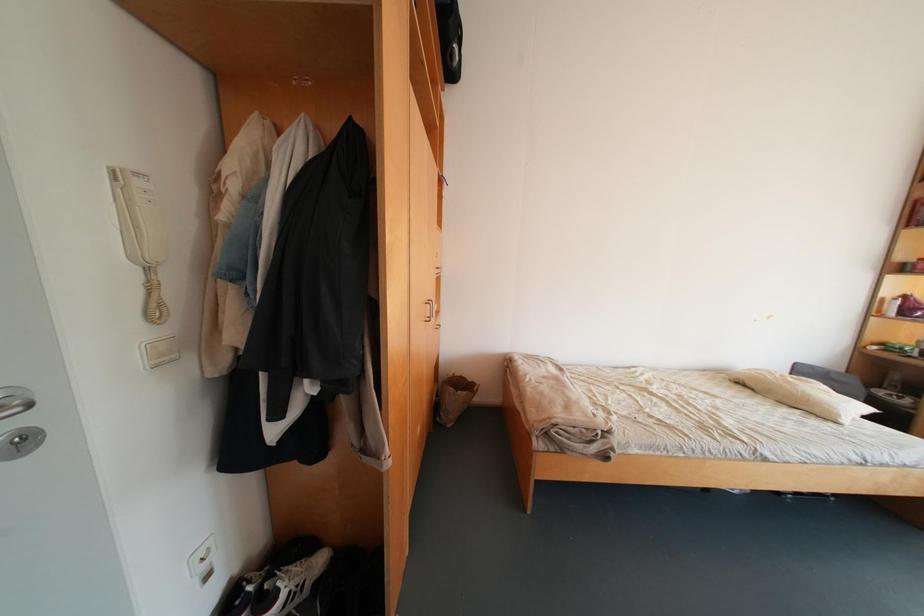
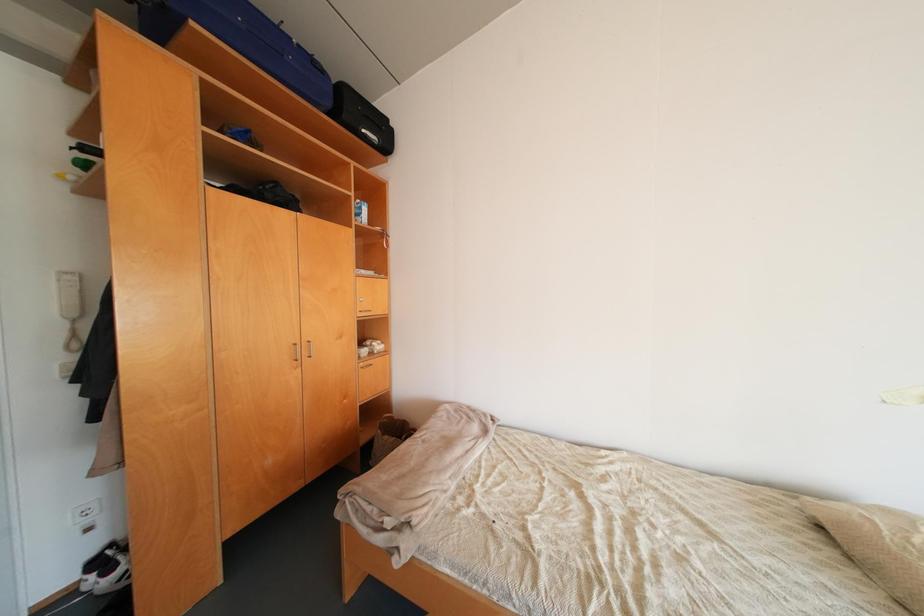
Question: What movement of the cameraman would produce the second image?

Choices:
 (A) Left
 (B) Right
 (C) Forward
 (D) Backward

Answer: (B)